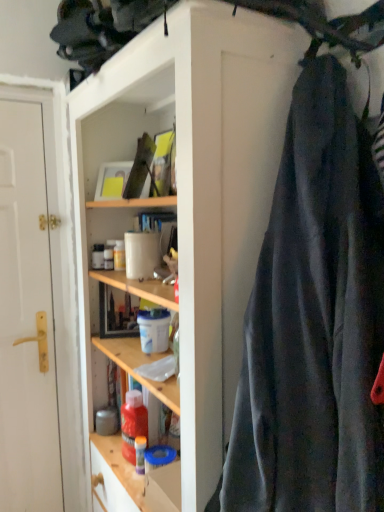
This screenshot has height=512, width=384. In order to click on wooden shelves at center in this screenshot , I will do `click(191, 193)`.

Describe the element at coordinates (314, 320) in the screenshot. The width and height of the screenshot is (384, 512). I see `dark gray fabric at right` at that location.

This screenshot has width=384, height=512. Find the location of `white matte door at left`. white matte door at left is located at coordinates (26, 319).

Locate an element on the screen. The width and height of the screenshot is (384, 512). wooden shelves at center is located at coordinates (191, 193).

Which of these two, wooden shelves at center or dark gray fabric at right, is bigger?

Bigger between the two is wooden shelves at center.

Does wooden shelves at center come behind dark gray fabric at right?

Yes, it is behind dark gray fabric at right.

Locate an element on the screen. clothing above the wooden shelves at center (from the image's perspective) is located at coordinates (314, 320).

Considering the relative sizes of white matte door at left and dark gray fabric at right in the image provided, is white matte door at left shorter than dark gray fabric at right?

No, white matte door at left is not shorter than dark gray fabric at right.

Considering the sizes of white matte door at left and dark gray fabric at right in the image, is white matte door at left wider or thinner than dark gray fabric at right?

white matte door at left is thinner than dark gray fabric at right.

Considering their positions, is white matte door at left located in front of or behind dark gray fabric at right?

In the image, white matte door at left appears behind dark gray fabric at right.

Considering the relative sizes of white matte door at left and dark gray fabric at right in the image provided, is white matte door at left bigger than dark gray fabric at right?

No, white matte door at left is not bigger than dark gray fabric at right.

From the image's perspective, is white matte door at left above wooden shelves at center?

Yes.

Identify the location of door above the wooden shelves at center (from the image's perspective). The height and width of the screenshot is (512, 384). (26, 319).

Is white matte door at left positioned with its back to wooden shelves at center?

No, wooden shelves at center is not at the back of white matte door at left.

Is white matte door at left with wooden shelves at center?

No.

Considering the positions of point (312, 385) and point (20, 501), is point (312, 385) closer or farther from the camera than point (20, 501)?

Point (312, 385).

In terms of height, does dark gray fabric at right look taller or shorter compared to white matte door at left?

dark gray fabric at right is shorter than white matte door at left.

In order to click on door on the left of dark gray fabric at right in this screenshot , I will do `click(26, 319)`.

Is the depth of dark gray fabric at right greater than that of white matte door at left?

No.

Considering the relative positions of wooden shelves at center and white matte door at left in the image provided, is wooden shelves at center to the left of white matte door at left from the viewer's perspective?

No, wooden shelves at center is not to the left of white matte door at left.

Can you confirm if wooden shelves at center is shorter than white matte door at left?

Correct, wooden shelves at center is not as tall as white matte door at left.

What's the angular difference between wooden shelves at center and white matte door at left's facing directions?

The facing directions of wooden shelves at center and white matte door at left are 88.9 degrees apart.

From the image's perspective, which one is positioned higher, wooden shelves at center or white matte door at left?

white matte door at left is shown above in the image.

Considering the relative positions of dark gray fabric at right and wooden shelves at center in the image provided, is dark gray fabric at right to the left or to the right of wooden shelves at center?

In the image, dark gray fabric at right appears on the right side of wooden shelves at center.

Is dark gray fabric at right facing away from wooden shelves at center?

No, dark gray fabric at right is not facing the opposite direction of wooden shelves at center.

How many degrees apart are the facing directions of dark gray fabric at right and wooden shelves at center?

They differ by 9.71e-05 degrees in their facing directions.

In order to click on cabinetry that appears on the left of dark gray fabric at right in this screenshot , I will do `click(191, 193)`.

You are a GUI agent. You are given a task and a screenshot of the screen. Output one action in this format:
    pyautogui.click(x=<x>, y=<y>)
    Task: Click on the clothing located on the right of white matte door at left
    
    Given the screenshot: What is the action you would take?
    pyautogui.click(x=314, y=320)

Which object lies nearer to the anchor point white matte door at left, dark gray fabric at right or wooden shelves at center?

Among the two, wooden shelves at center is located nearer to white matte door at left.

Based on the photo, from the image, which object appears to be nearer to dark gray fabric at right, wooden shelves at center or white matte door at left?

wooden shelves at center is positioned closer to the anchor dark gray fabric at right.

Which object lies nearer to the anchor point wooden shelves at center, dark gray fabric at right or white matte door at left?

The object closer to wooden shelves at center is dark gray fabric at right.

Which object lies nearer to the anchor point wooden shelves at center, white matte door at left or dark gray fabric at right?

Based on the image, dark gray fabric at right appears to be nearer to wooden shelves at center.

From the image, which object appears to be farther from dark gray fabric at right, white matte door at left or wooden shelves at center?

white matte door at left is positioned further to the anchor dark gray fabric at right.

Based on their spatial positions, is wooden shelves at center or dark gray fabric at right further from white matte door at left?

dark gray fabric at right is further to white matte door at left.

Image resolution: width=384 pixels, height=512 pixels. In order to click on cabinetry between dark gray fabric at right and white matte door at left from front to back in this screenshot , I will do `click(191, 193)`.